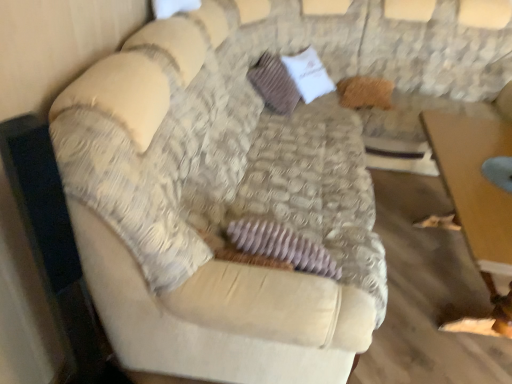
Question: From a real-world perspective, is velvet beige couch at center above or below wooden table at lower right?

Choices:
 (A) above
 (B) below

Answer: (A)

Question: Considering their positions, is velvet beige couch at center located in front of or behind wooden table at lower right?

Choices:
 (A) behind
 (B) front

Answer: (B)

Question: Which object is the closest to the wooden table at lower right?

Choices:
 (A) brown textured pillow at center
 (B) velvet beige couch at center

Answer: (B)

Question: Estimate the real-world distances between objects in this image. Which object is farther from the wooden table at lower right?

Choices:
 (A) velvet beige couch at center
 (B) brown textured pillow at center

Answer: (B)